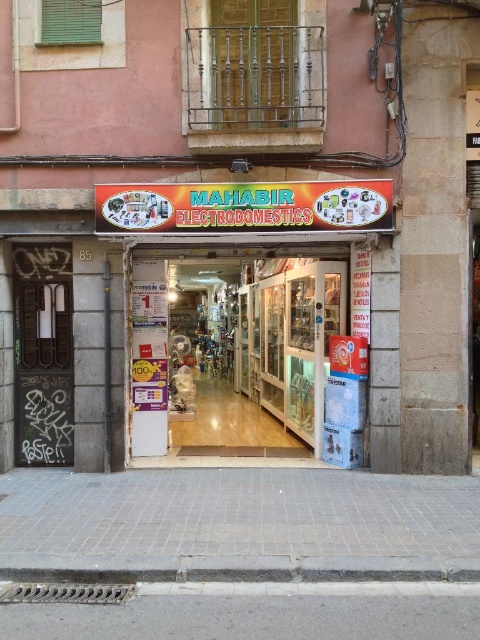
Question: Can you confirm if gray concrete pavement at lower center is bigger than gray concrete curb at lower center?

Choices:
 (A) yes
 (B) no

Answer: (A)

Question: Which point appears farthest from the camera in this image?

Choices:
 (A) (54, 416)
 (B) (187, 602)
 (C) (389, 580)

Answer: (A)

Question: Is grungy metal door at left below gray concrete curb at lower center?

Choices:
 (A) no
 (B) yes

Answer: (A)

Question: Among these objects, which one is nearest to the camera?

Choices:
 (A) grungy metal door at left
 (B) gray concrete pavement at lower center

Answer: (B)

Question: Which object is closer to the camera taking this photo?

Choices:
 (A) grungy metal door at left
 (B) gray concrete pavement at lower center

Answer: (B)

Question: Does gray concrete pavement at lower center have a larger size compared to grungy metal door at left?

Choices:
 (A) no
 (B) yes

Answer: (B)